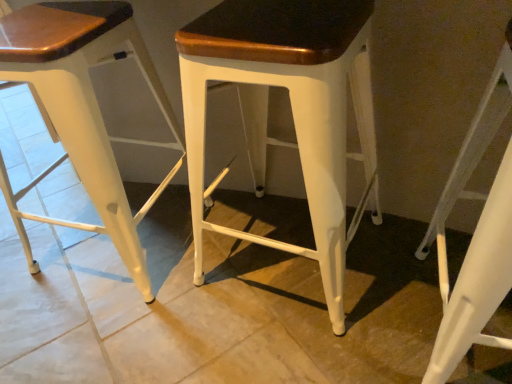
The height and width of the screenshot is (384, 512). Find the location of `vacant area on top of white metal stool at center, which is counted as the third stool, starting from the right (from a real-world perspective)`. vacant area on top of white metal stool at center, which is counted as the third stool, starting from the right (from a real-world perspective) is located at coordinates (44, 18).